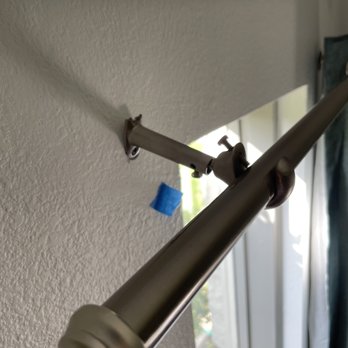
I want to click on the left of window, so click(182, 215).